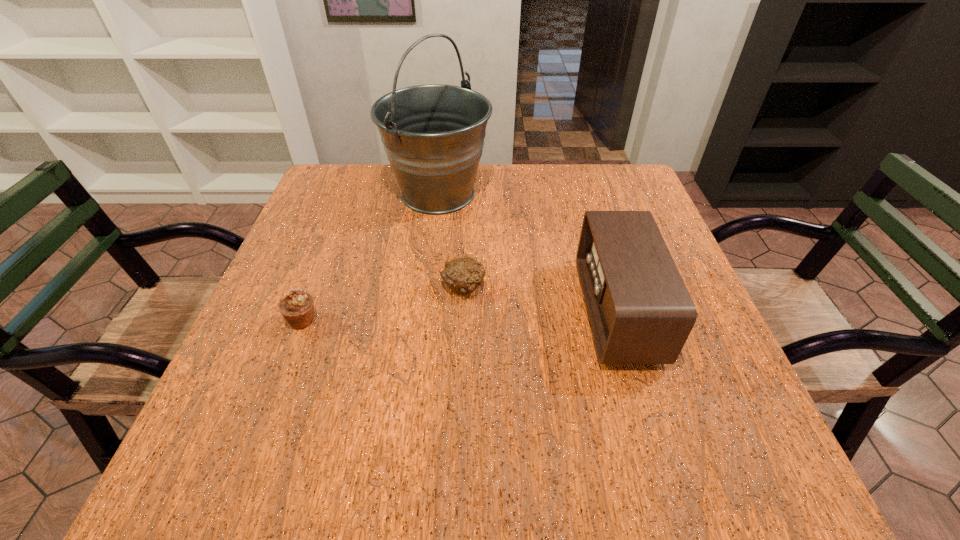
The height and width of the screenshot is (540, 960). In order to click on free space located on the front-facing side of the rightmost object in this screenshot , I will do `click(492, 312)`.

Identify the location of free space located 0.220m on the front-facing side of the rightmost object. (477, 312).

I want to click on vacant region located 0.290m on the right of the taller muffin, so click(465, 321).

Where is `blank area located 0.270m on the right of the farther muffin`? This screenshot has width=960, height=540. blank area located 0.270m on the right of the farther muffin is located at coordinates (612, 287).

Where is `object that is at the far edge`? This screenshot has width=960, height=540. object that is at the far edge is located at coordinates (433, 134).

The height and width of the screenshot is (540, 960). Identify the location of object located in the left edge section of the desktop. (297, 307).

You are a GUI agent. You are given a task and a screenshot of the screen. Output one action in this format:
    pyautogui.click(x=<x>, y=<y>)
    Task: Click on the object that is positioned at the right edge
    
    Given the screenshot: What is the action you would take?
    pyautogui.click(x=640, y=311)

The image size is (960, 540). I want to click on free space at the far edge, so click(491, 205).

Where is `vacant space at the near edge`? The image size is (960, 540). vacant space at the near edge is located at coordinates (329, 457).

I want to click on vacant space at the left edge of the desktop, so click(x=324, y=226).